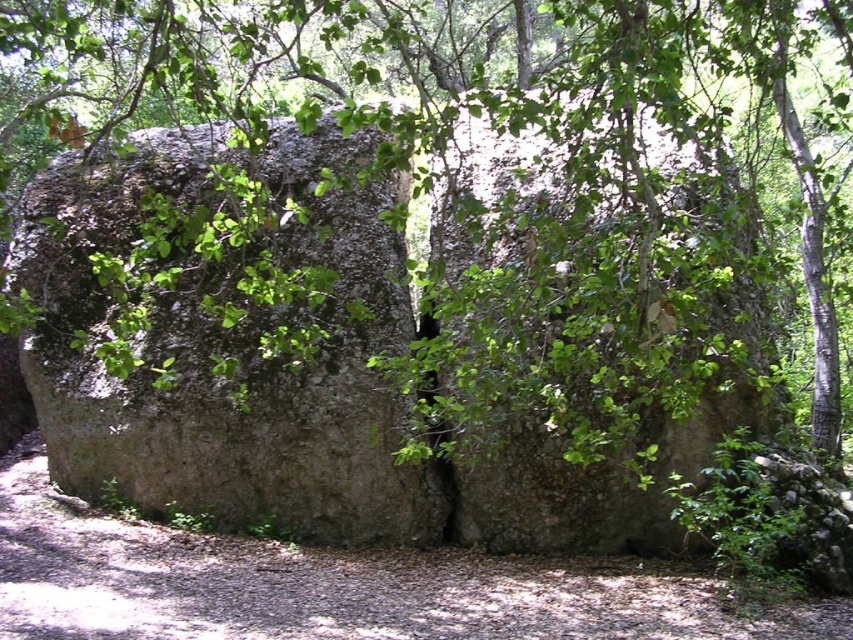
The image size is (853, 640). Describe the element at coordinates (467, 200) in the screenshot. I see `green leafy tree at center` at that location.

You are a GUI agent. You are given a task and a screenshot of the screen. Output one action in this format:
    pyautogui.click(x=<x>, y=<y>)
    Task: Click on the green leafy tree at center
    
    Given the screenshot: What is the action you would take?
    pyautogui.click(x=467, y=200)

At what (x,y) coordinates should I click in order to perform the action: click on green leafy tree at center. Please return your answer as a coordinate pair (x, y). This screenshot has width=853, height=640. Looking at the image, I should click on (467, 200).